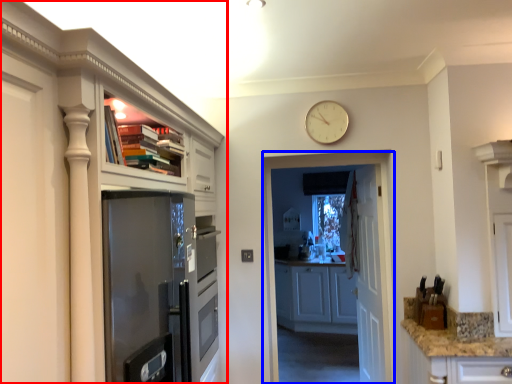
Question: Which of the following is the closest to the observer, cabinetry (highlighted by a red box) or screen door (highlighted by a blue box)?

Choices:
 (A) cabinetry
 (B) screen door

Answer: (A)